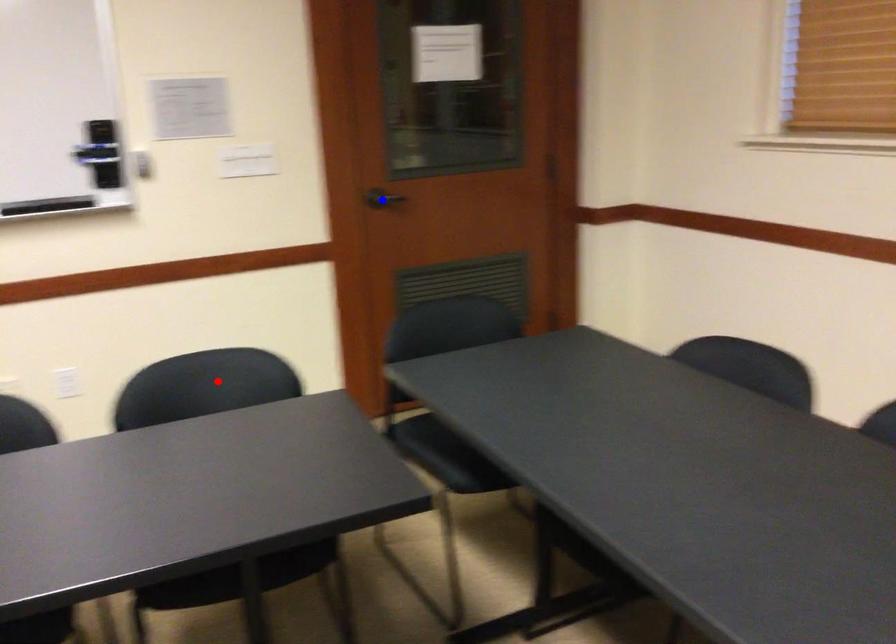
Question: Which of the two points in the image is closer to the camera?

Choices:
 (A) Blue point is closer.
 (B) Red point is closer.

Answer: (B)